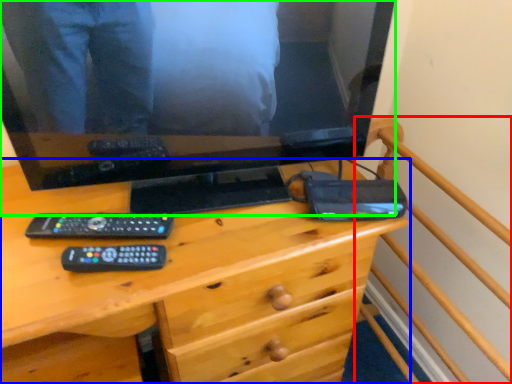
Question: Estimate the real-world distances between objects in this image. Which object is farther from bed frame (highlighted by a red box), desk (highlighted by a blue box) or television (highlighted by a green box)?

Choices:
 (A) desk
 (B) television

Answer: (B)